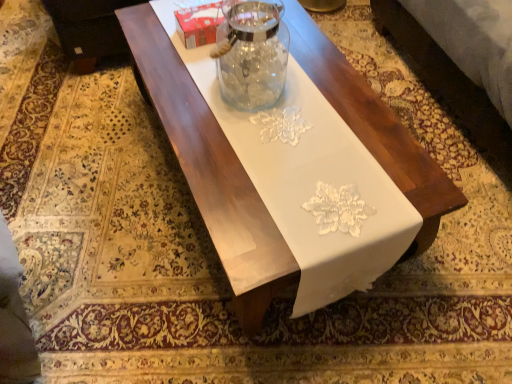
Question: Relative to transparent glass jar at center, is white glossy table at center in front or behind?

Choices:
 (A) behind
 (B) front

Answer: (B)

Question: From the image's perspective, is white glossy table at center above or below transparent glass jar at center?

Choices:
 (A) above
 (B) below

Answer: (B)

Question: Considering the real-world distances, which object is farthest from the black leather couch at upper left?

Choices:
 (A) white glossy table at center
 (B) transparent glass jar at center

Answer: (B)

Question: Which object is the closest to the white glossy table at center?

Choices:
 (A) black leather couch at upper left
 (B) transparent glass jar at center

Answer: (B)